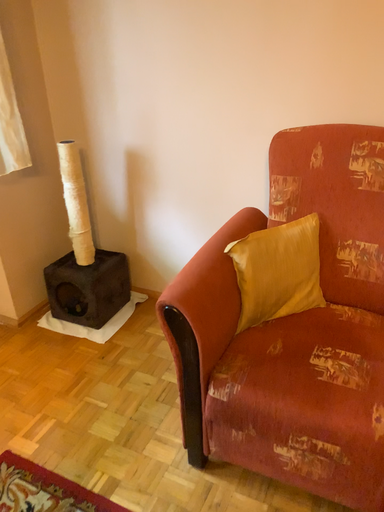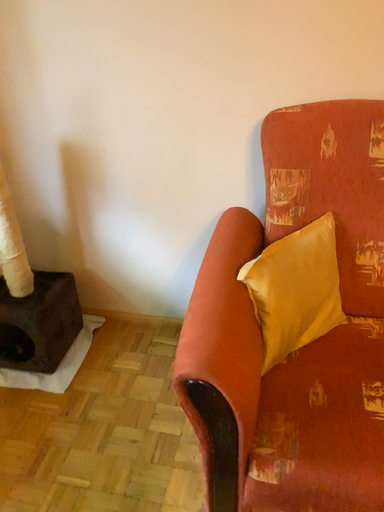
Question: How did the camera likely rotate when shooting the video?

Choices:
 (A) rotated right
 (B) rotated left

Answer: (A)